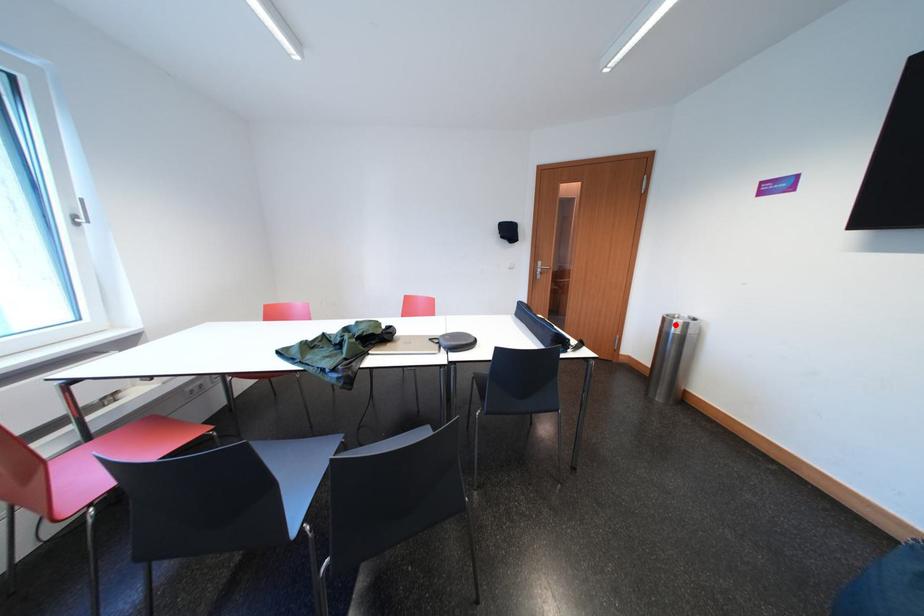
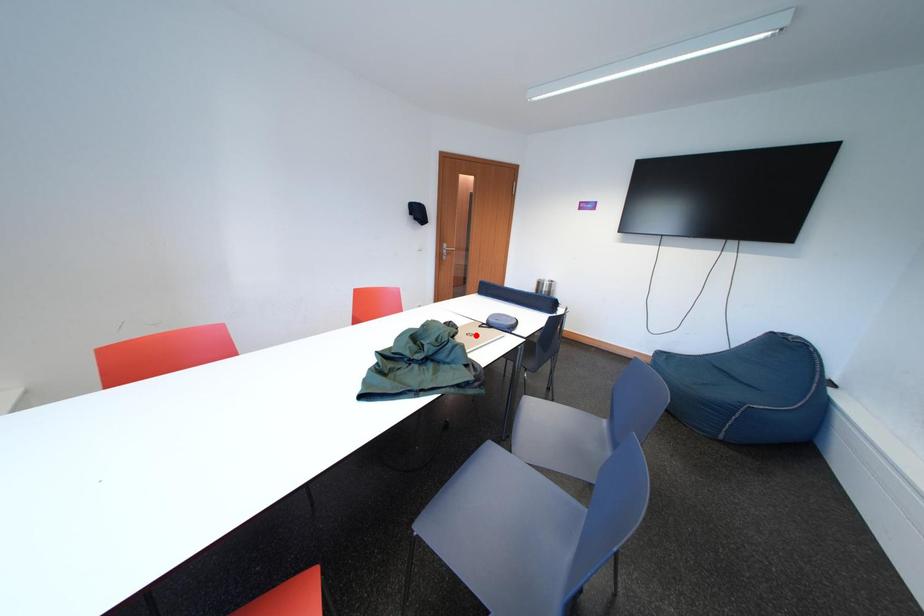
I am providing you with two images of the same scene from different viewpoints. A red point is marked on the first image and another point is marked on the second image. Are the points marked in image1 and image2 representing the same 3D position?

No